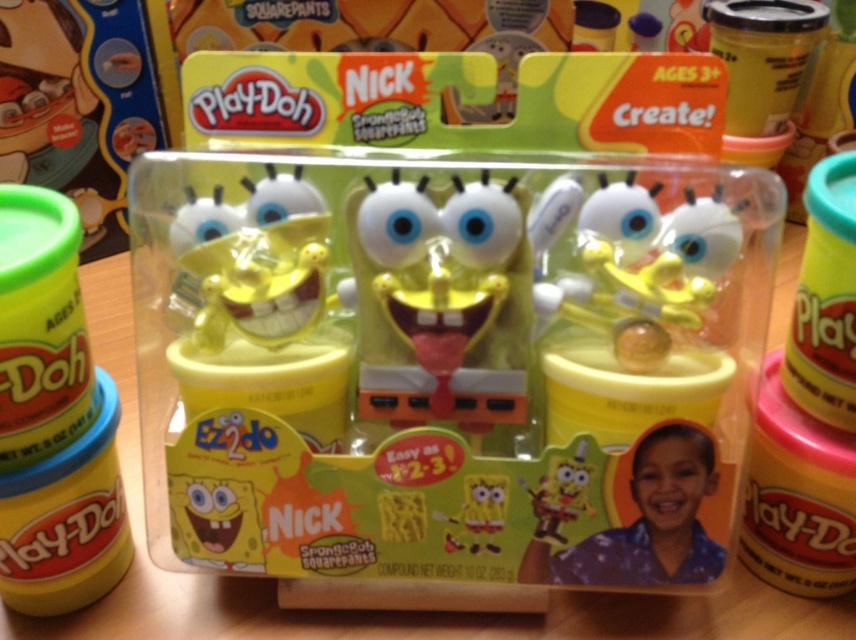
How would you describe the texture of the object located at point [654,518] on the PlayDoh packaging?

The object at point [654,518] is a matte yellow sponge.

What is the spatial relationship between the matte yellow sponge at center and the yellow matte sponge at center?

The matte yellow sponge at center is in front of the yellow matte sponge at center according to the description.